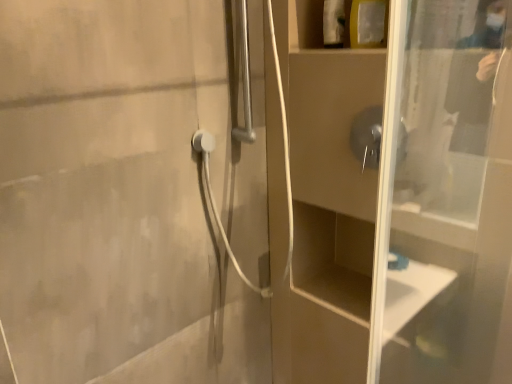
Identify the location of transparent glass door at upper right. (330, 196).

The height and width of the screenshot is (384, 512). What do you see at coordinates (330, 196) in the screenshot?
I see `transparent glass door at upper right` at bounding box center [330, 196].

Locate an element on the screen. This screenshot has height=384, width=512. transparent glass door at upper right is located at coordinates (330, 196).